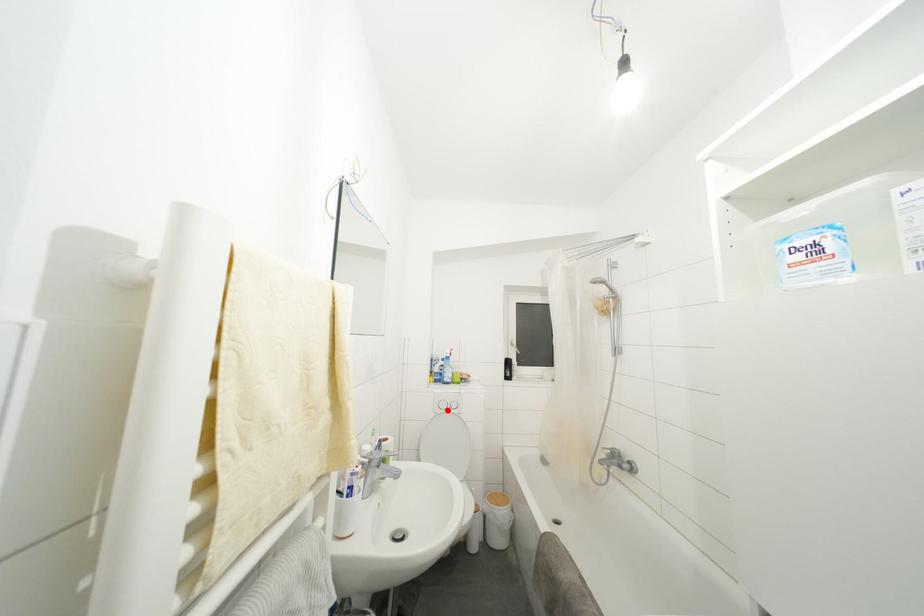
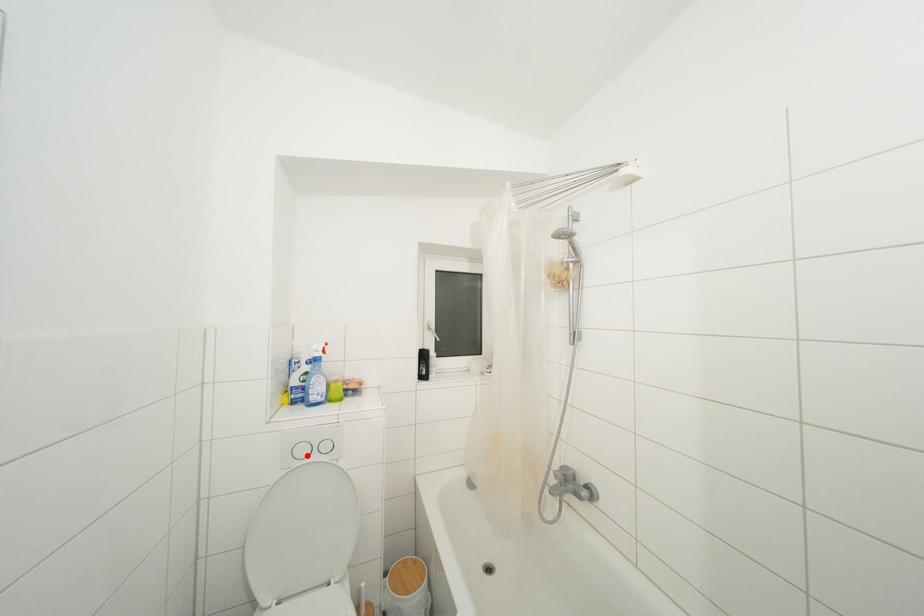
I am providing you with two images of the same scene from different viewpoints. A red point is marked on the first image and another point is marked on the second image. Do the highlighted points in image1 and image2 indicate the same real-world spot?

Yes